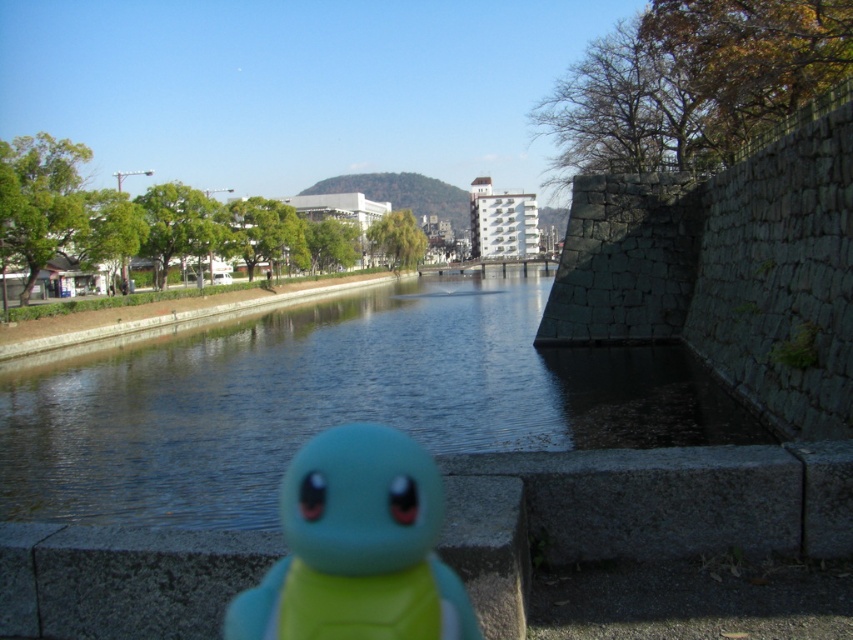
You are a child who wants to place the teal rubber toy at center into the blue water at center. Considering the size of the water and the toy, will there be enough space for the toy to float freely without touching the edges?

The blue water at center has a larger width than the teal rubber toy at center, so yes, there will be enough space for the teal rubber toy at center to float freely without touching the edges.

You are standing at the riverside and want to place a small flag at each of the two points marked as point (398, 310) and point (390, 566). Which point is closer to you so that you can reach it without moving your feet?

Point (398, 310) is closer to you than point (390, 566), so you can reach it without moving your feet.